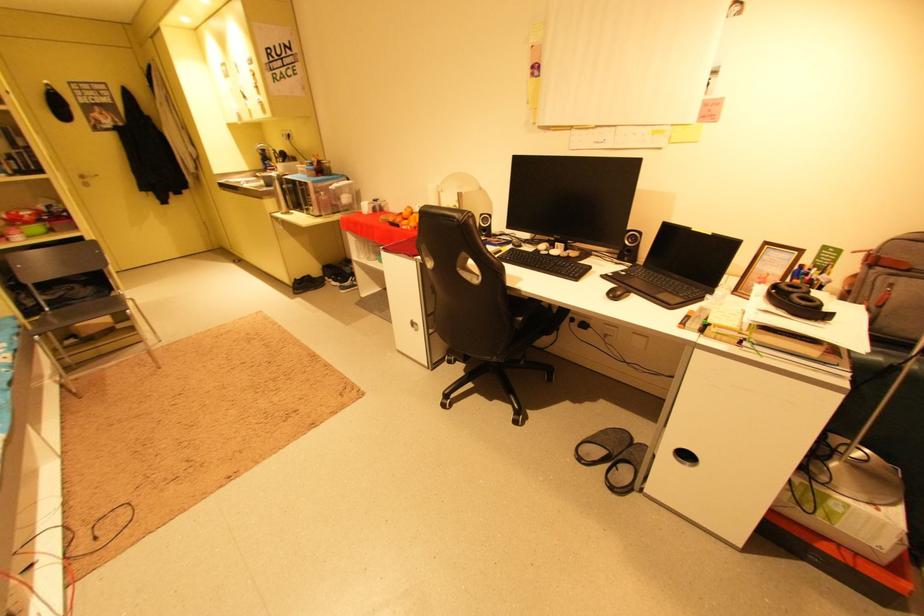
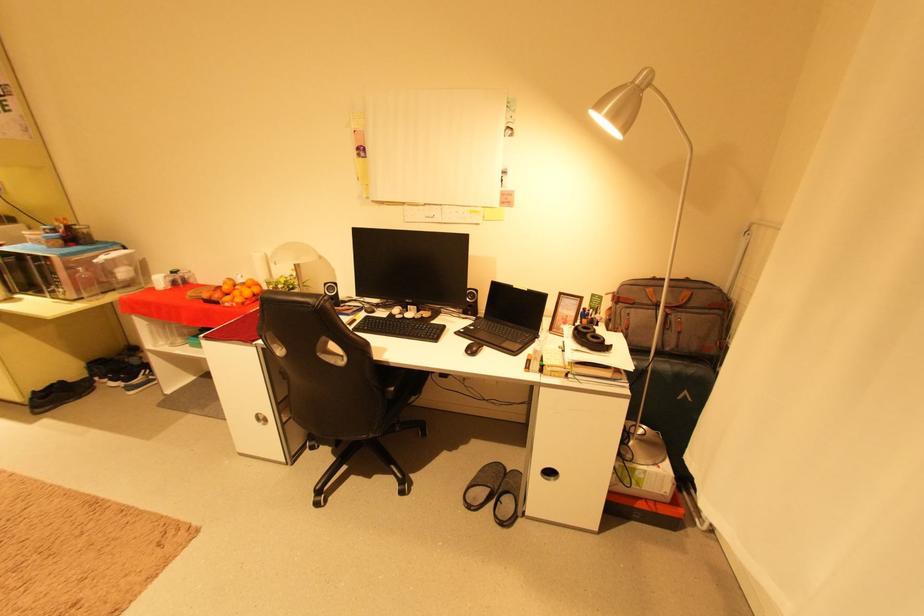
Locate, in the second image, the point that corresponds to [529,320] in the first image.

(399, 390)